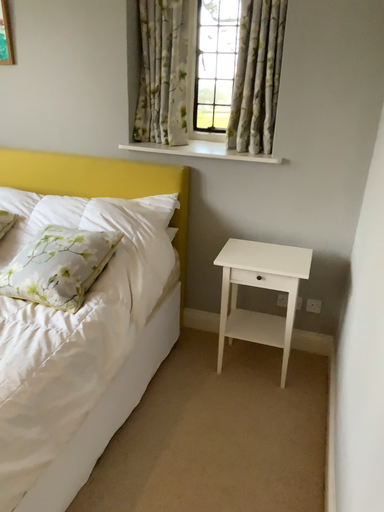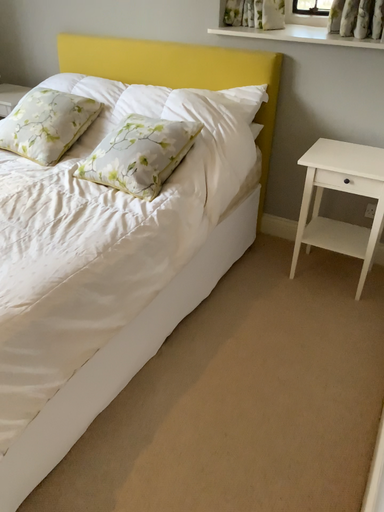
Question: Which way did the camera rotate in the video?

Choices:
 (A) rotated downward
 (B) rotated upward

Answer: (A)